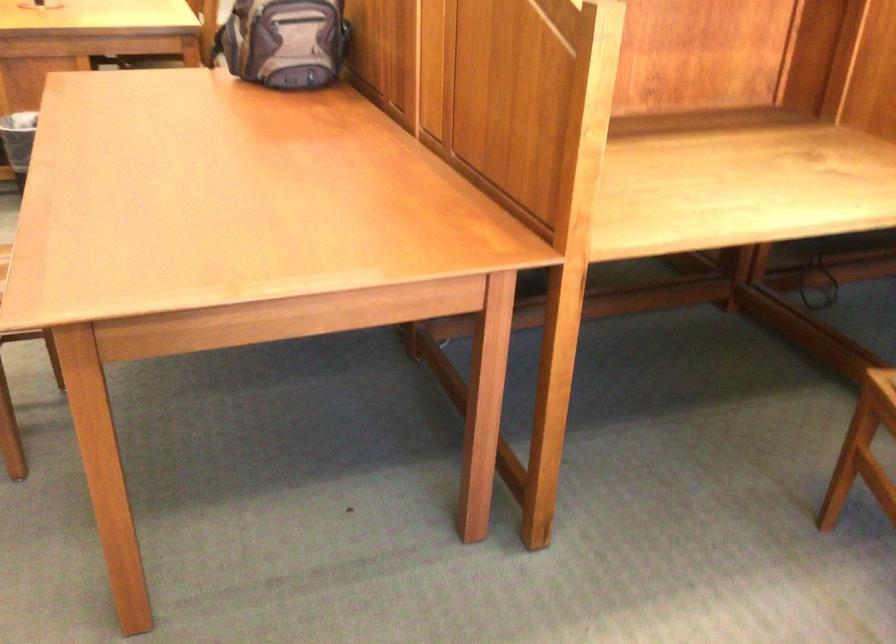
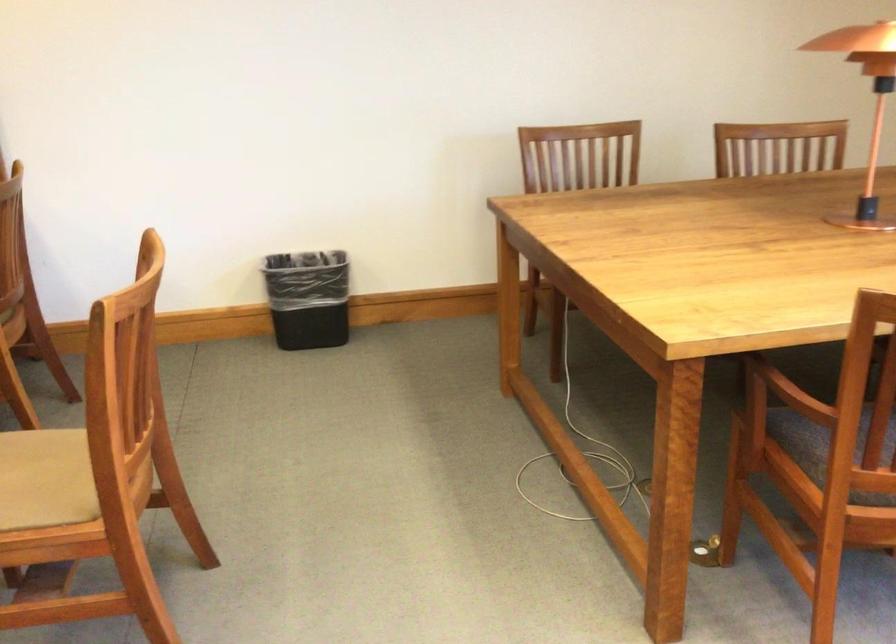
Question: How did the camera likely rotate?

Choices:
 (A) Left
 (B) Right
 (C) Up
 (D) Down

Answer: (B)